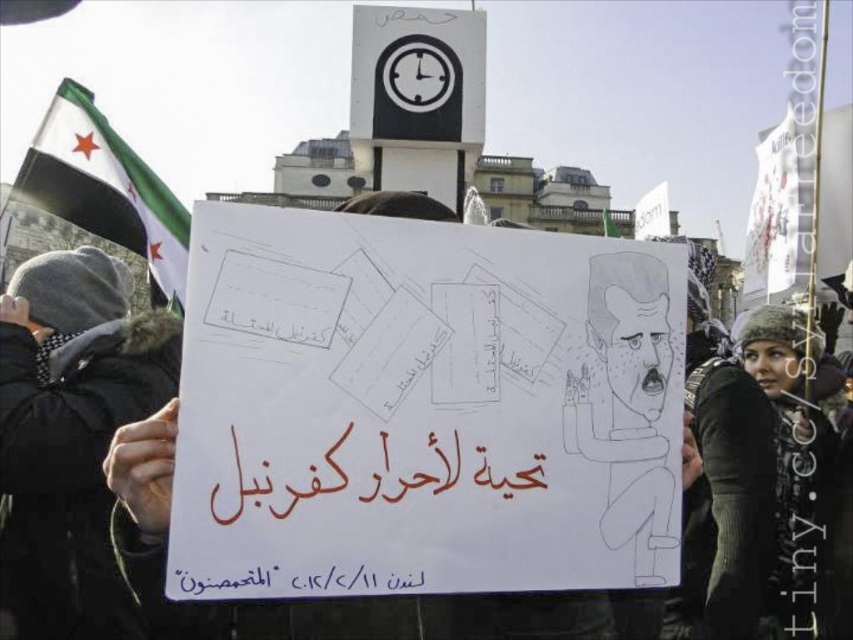
You are a photographer trying to capture the protest scene. You notice the dark gray knit hat at upper left and the white fabric flag at upper left in your frame. Which object should you adjust your focus to if you want to focus on the one that is nearer to you?

The dark gray knit hat at upper left is closer to the viewer than the white fabric flag at upper left, so you should focus on the dark gray knit hat at upper left to capture the nearer object.

You are standing in the protest scene and want to determine the relative positions of two points marked on the sign. Which point is closer to you, point 1 at coordinates (550, 627) or point 2 at coordinates (416, 582)?

Point 1 at coordinates (550, 627) is closer to you because it is further to the viewer than point 2 at coordinates (416, 582).